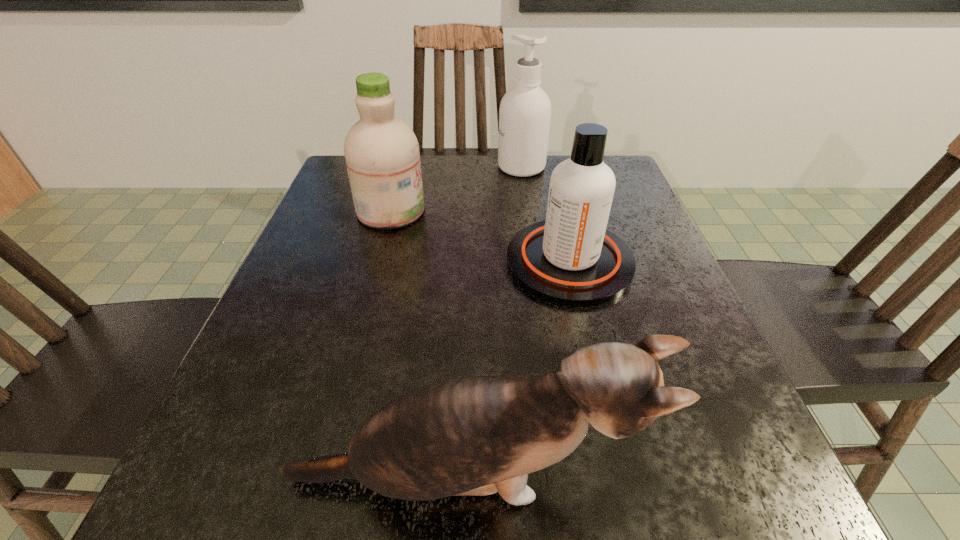
This screenshot has width=960, height=540. Find the location of `cat that is at the left edge`. cat that is at the left edge is located at coordinates [x=472, y=436].

The image size is (960, 540). Find the location of `object present at the right edge`. object present at the right edge is located at coordinates [571, 259].

I want to click on object at the far left corner, so click(x=382, y=156).

Find the location of a particular element. object situated at the near left corner is located at coordinates (472, 436).

In the image, there is a desktop. Identify the location of free space at the far edge. (440, 157).

The height and width of the screenshot is (540, 960). Find the location of `vacant space at the left edge of the desktop`. vacant space at the left edge of the desktop is located at coordinates (297, 252).

Where is `vacant area at the right edge`? vacant area at the right edge is located at coordinates (744, 418).

You are a GUI agent. You are given a task and a screenshot of the screen. Output one action in this format:
    pyautogui.click(x=<x>, y=<y>)
    Task: Click on the vacant space at the near right corner of the desktop
    The height and width of the screenshot is (540, 960).
    Given the screenshot: What is the action you would take?
    pyautogui.click(x=758, y=523)

The width and height of the screenshot is (960, 540). I want to click on vacant area that lies between the farthest object and the leftmost cleansing agent, so click(x=456, y=189).

Find the location of a particular element. vacant area between the cat and the leftmost cleansing agent is located at coordinates (427, 345).